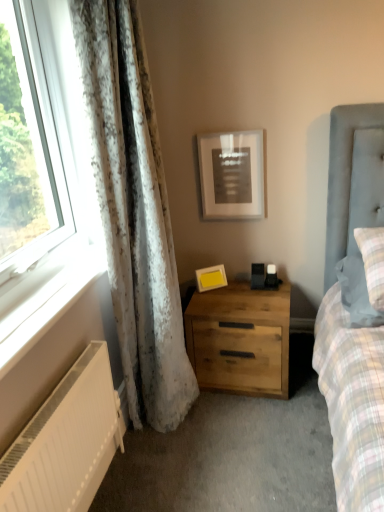
Question: Does white textured curtain at left turn towards yellow matte picture frame at upper center, the 1th picture frame positioned from the bottom?

Choices:
 (A) yes
 (B) no

Answer: (B)

Question: Is white textured curtain at left next to yellow matte picture frame at upper center, the 1th picture frame positioned from the bottom, and touching it?

Choices:
 (A) no
 (B) yes

Answer: (A)

Question: Does white textured curtain at left contain yellow matte picture frame at upper center, the 2th picture frame when ordered from top to bottom?

Choices:
 (A) no
 (B) yes

Answer: (A)

Question: Considering the relative positions of white textured curtain at left and yellow matte picture frame at upper center, the 2th picture frame when ordered from top to bottom, in the image provided, is white textured curtain at left in front of yellow matte picture frame at upper center, the 2th picture frame when ordered from top to bottom,?

Choices:
 (A) no
 (B) yes

Answer: (B)

Question: Is white textured curtain at left taller than yellow matte picture frame at upper center, the 2th picture frame when ordered from top to bottom?

Choices:
 (A) no
 (B) yes

Answer: (B)

Question: From a real-world perspective, is white textured curtain at left positioned over yellow matte picture frame at upper center, the 1th picture frame positioned from the bottom, based on gravity?

Choices:
 (A) yes
 (B) no

Answer: (A)

Question: Can you confirm if white matte radiator at lower left is taller than matte black picture frame at upper center, acting as the first picture frame starting from the top?

Choices:
 (A) yes
 (B) no

Answer: (A)

Question: Considering the relative positions of white matte radiator at lower left and matte black picture frame at upper center, the second picture frame ordered from the bottom, in the image provided, is white matte radiator at lower left to the right of matte black picture frame at upper center, the second picture frame ordered from the bottom, from the viewer's perspective?

Choices:
 (A) yes
 (B) no

Answer: (B)

Question: Is white matte radiator at lower left oriented away from matte black picture frame at upper center, the second picture frame ordered from the bottom?

Choices:
 (A) yes
 (B) no

Answer: (B)

Question: Can you confirm if white matte radiator at lower left is thinner than matte black picture frame at upper center, acting as the first picture frame starting from the top?

Choices:
 (A) yes
 (B) no

Answer: (B)

Question: Can you confirm if white matte radiator at lower left is bigger than matte black picture frame at upper center, the second picture frame ordered from the bottom?

Choices:
 (A) yes
 (B) no

Answer: (A)

Question: Is white matte radiator at lower left positioned before matte black picture frame at upper center, the second picture frame ordered from the bottom?

Choices:
 (A) no
 (B) yes

Answer: (B)

Question: Is plaid fabric pillow at right thinner than natural wood nightstand at center?

Choices:
 (A) yes
 (B) no

Answer: (B)